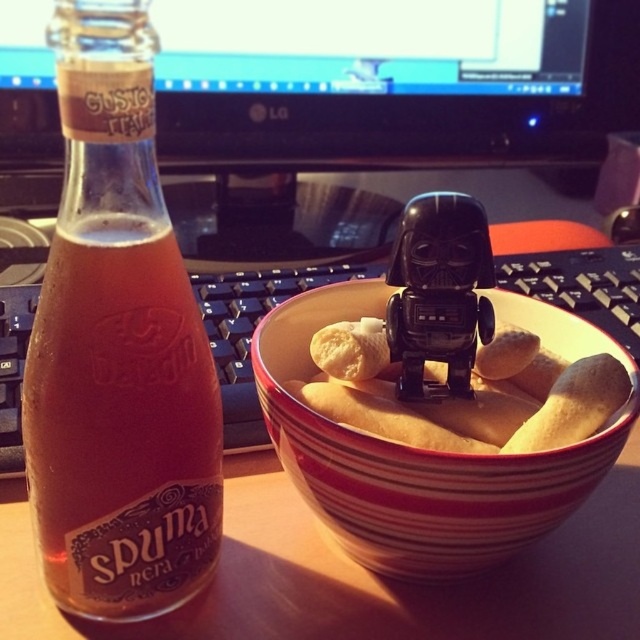
You are setting up a small table for a snack. You have a translucent glass bottle at left and a black plastic toy at center. Where should you place the bottle relative to the toy to match the image?

The translucent glass bottle at left should be placed to the left of the black plastic toy at center to match the image.

You are organizing a snack platter and have a yellow matte bread at center and a black plastic toy at center. If you want to arrange them side by side on a narrow plate, which item should you place first to ensure both fit?

The black plastic toy at center is smaller in width than the yellow matte bread at center, so you should place the black plastic toy at center first to leave enough space for the wider bread.

You are organizing a snack platter and need to place the yellow matte bread at center. Where should you position it relative to the other items on the desk?

The yellow matte bread at center should be positioned at coordinates approximately 0.623 on the x axis and 0.720 on the y axis, as specified in the scene description.